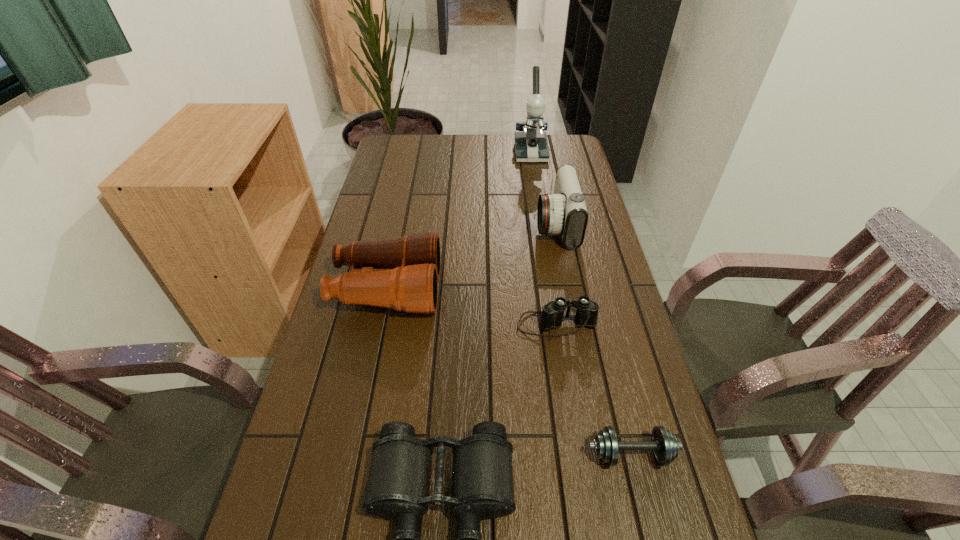
This screenshot has height=540, width=960. Identify the location of the tallest object. (531, 145).

You are a GUI agent. You are given a task and a screenshot of the screen. Output one action in this format:
    pyautogui.click(x=<x>, y=<y>)
    Task: Click on the farthest object
    The height and width of the screenshot is (540, 960).
    Given the screenshot: What is the action you would take?
    pyautogui.click(x=531, y=145)

Where is `the fifth shortest object`? This screenshot has height=540, width=960. the fifth shortest object is located at coordinates (564, 212).

Identify the location of camcorder. This screenshot has height=540, width=960. (564, 212).

Where is `the fourth shortest object`? The width and height of the screenshot is (960, 540). the fourth shortest object is located at coordinates (401, 273).

The width and height of the screenshot is (960, 540). Identify the location of the rightmost binoculars. (552, 316).

The image size is (960, 540). Find the location of `the shortest object`. the shortest object is located at coordinates point(664,444).

The height and width of the screenshot is (540, 960). In order to click on free space located 0.370m on the left of the microscope in this screenshot , I will do `click(422, 153)`.

Find the location of a particular element. Image resolution: width=960 pixels, height=540 pixels. free spot located on the surface of the fifth shortest object is located at coordinates (472, 225).

What are the coordinates of `vacant space located on the surface of the fifth shortest object` in the screenshot? It's located at 469,225.